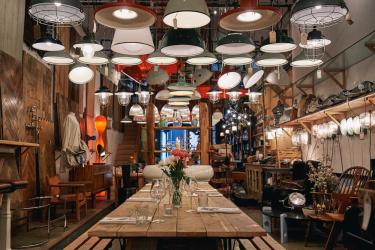
I want to click on coffee table, so click(295, 217).